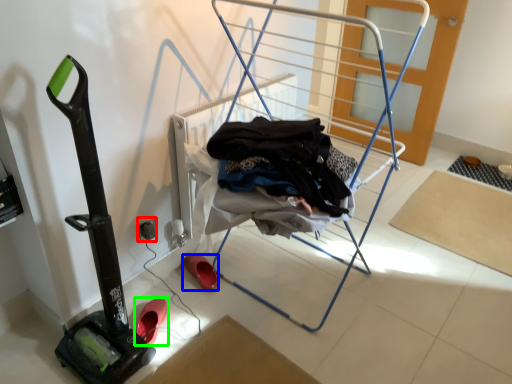
Question: Estimate the real-world distances between objects in this image. Which object is farther from electric outlet (highlighted by a red box), footwear (highlighted by a blue box) or footwear (highlighted by a green box)?

Choices:
 (A) footwear
 (B) footwear

Answer: (B)